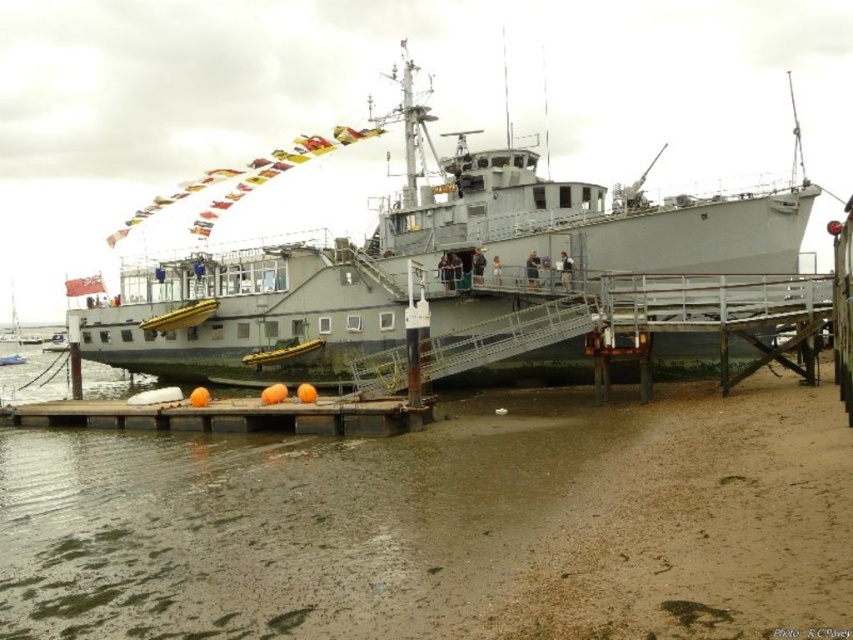
You are standing on the pier and want to board the ship. There are two points marked on the ramp leading to the ship. The first point is at coordinates point (194, 467) and the second is at point (648, 252). Which point is closer to the ship?

Point (194, 467) is in front of point (648, 252), so it is closer to the ship.